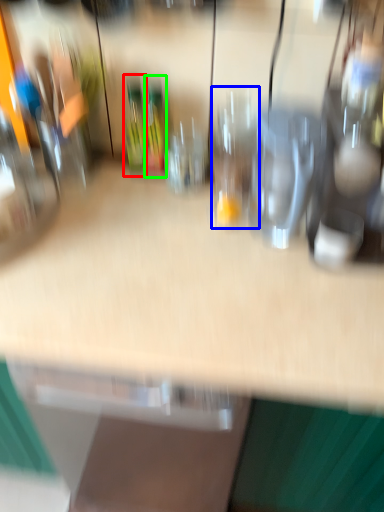
Question: Which object is positioned farthest from bottle (highlighted by a red box)? Select from wine glass (highlighted by a blue box) and wine bottle (highlighted by a green box).

Choices:
 (A) wine glass
 (B) wine bottle

Answer: (A)